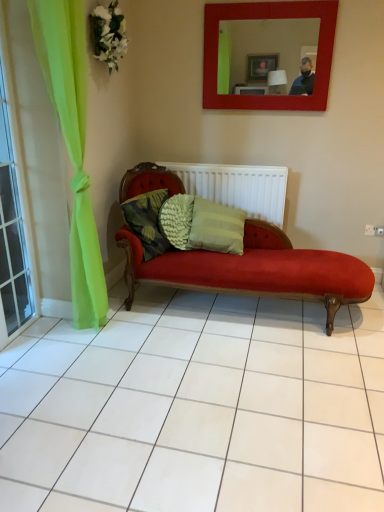
Question: Are textured green pillow at center and matte red mirror at upper center beside each other?

Choices:
 (A) no
 (B) yes

Answer: (A)

Question: Is textured green pillow at center far from matte red mirror at upper center?

Choices:
 (A) no
 (B) yes

Answer: (B)

Question: Is textured green pillow at center to the right of matte red mirror at upper center from the viewer's perspective?

Choices:
 (A) yes
 (B) no

Answer: (B)

Question: Is textured green pillow at center positioned with its back to matte red mirror at upper center?

Choices:
 (A) yes
 (B) no

Answer: (B)

Question: Does textured green pillow at center come in front of matte red mirror at upper center?

Choices:
 (A) no
 (B) yes

Answer: (B)

Question: Can you confirm if textured green pillow at center is bigger than matte red mirror at upper center?

Choices:
 (A) yes
 (B) no

Answer: (B)

Question: Is the depth of matte red mirror at upper center greater than that of clear glass window at left?

Choices:
 (A) no
 (B) yes

Answer: (B)

Question: Is there a large distance between matte red mirror at upper center and clear glass window at left?

Choices:
 (A) yes
 (B) no

Answer: (A)

Question: Does matte red mirror at upper center have a larger size compared to clear glass window at left?

Choices:
 (A) no
 (B) yes

Answer: (A)

Question: Considering the relative sizes of matte red mirror at upper center and clear glass window at left in the image provided, is matte red mirror at upper center wider than clear glass window at left?

Choices:
 (A) no
 (B) yes

Answer: (B)

Question: Considering the relative positions of matte red mirror at upper center and clear glass window at left in the image provided, is matte red mirror at upper center in front of clear glass window at left?

Choices:
 (A) yes
 (B) no

Answer: (B)

Question: Can you confirm if matte red mirror at upper center is shorter than clear glass window at left?

Choices:
 (A) no
 (B) yes

Answer: (B)

Question: Is matte red mirror at upper center next to white textured radiator at center and touching it?

Choices:
 (A) yes
 (B) no

Answer: (B)